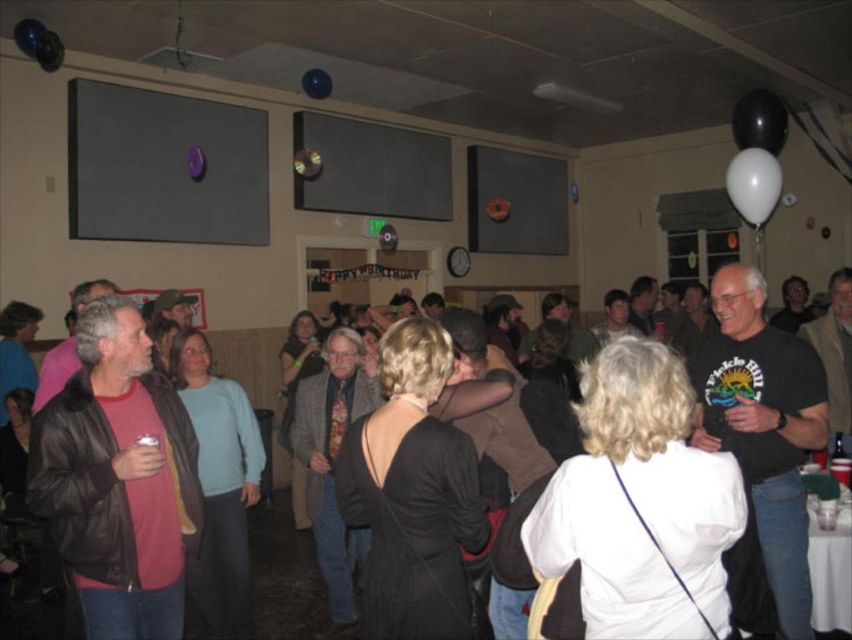
You are at the center of the room and want to place a gift box at the same horizontal level as the leather jacket at left. Where should you place the gift box horizontally?

Result: The leather jacket at left is positioned at point 0.750 on the horizontal axis, so you should place the gift box at the same horizontal coordinate, 0.750, to match its position.

You are a guest at the party and want to locate both the leather jacket at left and the metallic reflective button at upper center. Which object would appear taller when viewed from the front of the room?

The leather jacket at left appears taller than the metallic reflective button at upper center because it has a greater height compared to it according to the description.

You are a photographer taking a picture of the room. The shiny blue balloon at upper left is part of the scene. Where should you position the balloon in the photo to ensure it appears in the upper left corner?

The shiny blue balloon at upper left is already positioned at the upper left corner of the photo at coordinates (30, 36), so positioning it there would keep it in the desired location.